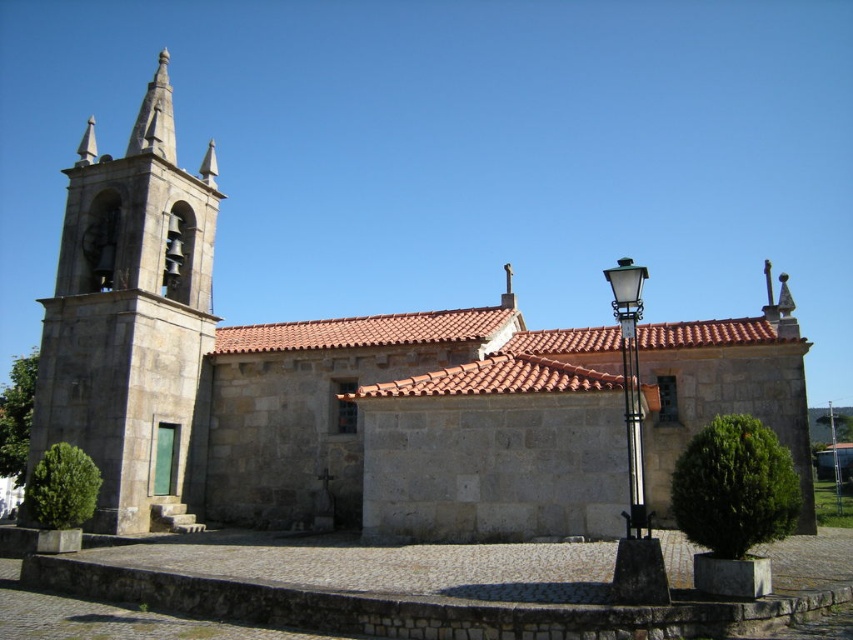
Question: Is stone bell tower at left thinner than black metal/iron streetlight at right?

Choices:
 (A) no
 (B) yes

Answer: (B)

Question: Can you confirm if stone bell tower at left is positioned to the left of black metal/iron streetlight at right?

Choices:
 (A) yes
 (B) no

Answer: (A)

Question: Which object appears closest to the camera in this image?

Choices:
 (A) stone bell tower at left
 (B) stone church at left

Answer: (B)

Question: Which object is closer to the camera taking this photo?

Choices:
 (A) stone church at left
 (B) black metal/iron streetlight at right
 (C) stone bell tower at left

Answer: (A)

Question: Can you confirm if stone church at left is positioned to the left of stone bell tower at left?

Choices:
 (A) no
 (B) yes

Answer: (A)

Question: Which of the following is the closest to the observer?

Choices:
 (A) (631, 314)
 (B) (83, 356)
 (C) (170, 301)

Answer: (A)